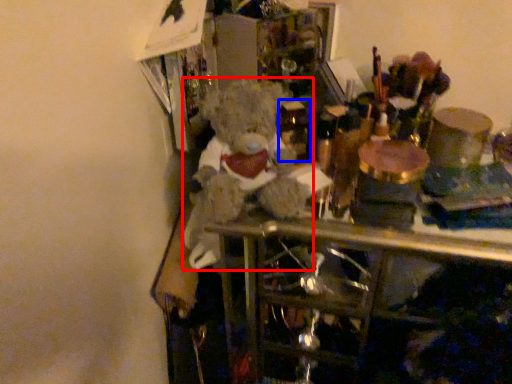
Question: Among these objects, which one is nearest to the camera, teddy bear (highlighted by a red box) or wine bottle (highlighted by a blue box)?

Choices:
 (A) teddy bear
 (B) wine bottle

Answer: (A)